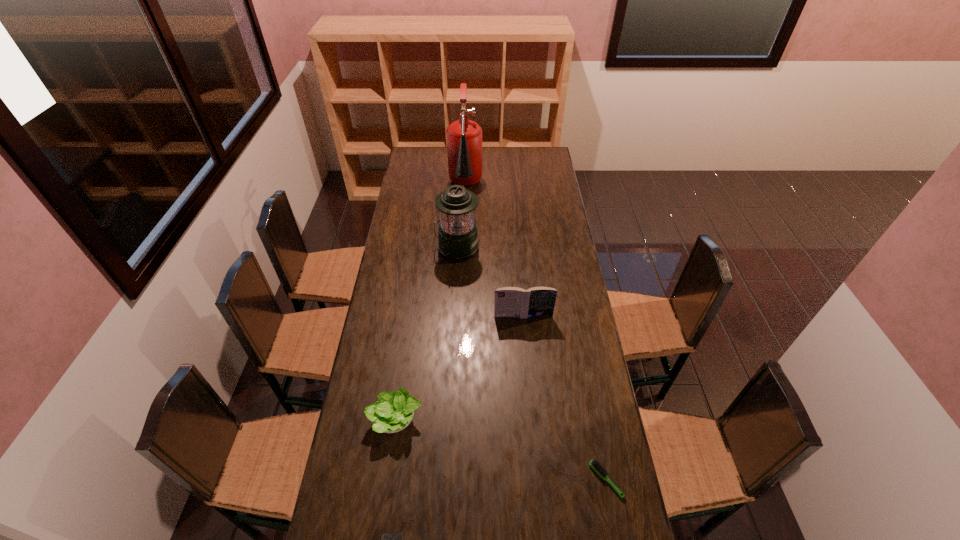
Locate an element on the screen. vacant position located 0.210m with the nozzle aimed from the tallest object is located at coordinates (464, 235).

You are a GUI agent. You are given a task and a screenshot of the screen. Output one action in this format:
    pyautogui.click(x=<x>, y=<y>)
    Task: Click on the vacant region located on the left of the lantern
    
    Given the screenshot: What is the action you would take?
    pyautogui.click(x=390, y=248)

Locate an element on the screen. This screenshot has height=540, width=960. vacant region located on the front cover of the fourth shortest object is located at coordinates (527, 360).

Locate an element on the screen. This screenshot has width=960, height=540. free space located 0.110m on the front of the fourth tallest object is located at coordinates (388, 478).

This screenshot has width=960, height=540. Identify the location of vacant space located on the left of the hairbrush. (557, 480).

Locate an element on the screen. object that is at the left edge is located at coordinates point(393,412).

At what (x,y) coordinates should I click in order to perform the action: click on book at the right edge. Please return your answer as a coordinate pair (x, y). The height and width of the screenshot is (540, 960). Looking at the image, I should click on (509, 301).

Where is `hairbrush located in the right edge section of the desktop`? hairbrush located in the right edge section of the desktop is located at coordinates (594, 464).

Where is `vacant space at the far edge of the desktop`? The width and height of the screenshot is (960, 540). vacant space at the far edge of the desktop is located at coordinates (498, 163).

Where is `free region at the left edge of the desktop`? The height and width of the screenshot is (540, 960). free region at the left edge of the desktop is located at coordinates (420, 218).